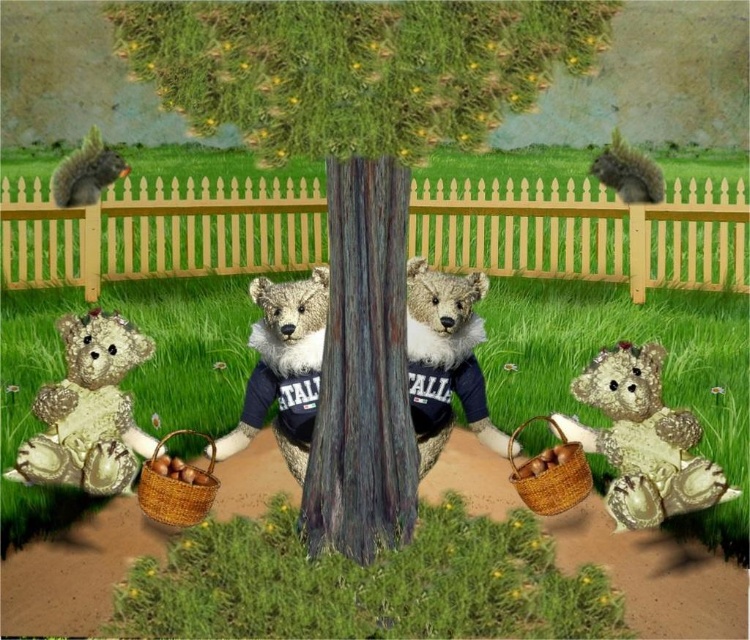
You are a squirrel trying to collect acorns from the baskets. You can only reach items that are taller than you. Which of the two items, the fluffy beige teddy bear at lower right or the brown woven basket at lower left, can you climb onto to reach the acorns?

The fluffy beige teddy bear at lower right is taller than the brown woven basket at lower left, so the squirrel can climb onto the fluffy beige teddy bear at lower right to reach the acorns.

You are a squirrel trying to collect acorns from the brown woven basket at lower left while avoiding the fluffy beige teddy bear at lower right. If your maximum jumping distance is 6 feet, can you safely jump from your current position near the tree trunk to the basket without getting too close to the teddy bear?

The distance between the fluffy beige teddy bear at lower right and the brown woven basket at lower left is 6.48 feet. Since your maximum jumping distance is 6 feet, you cannot safely jump to the basket without exceeding your limit, which might bring you too close to the teddy bear.

In the scene shown: You are standing in the garden scene and want to place a new red flower pot exactly at the point marked as point (88, 410). Which object from the teddy bears holding baskets is located at this point?

The fluffy beige teddy bear at lower left is located at point (88, 410).